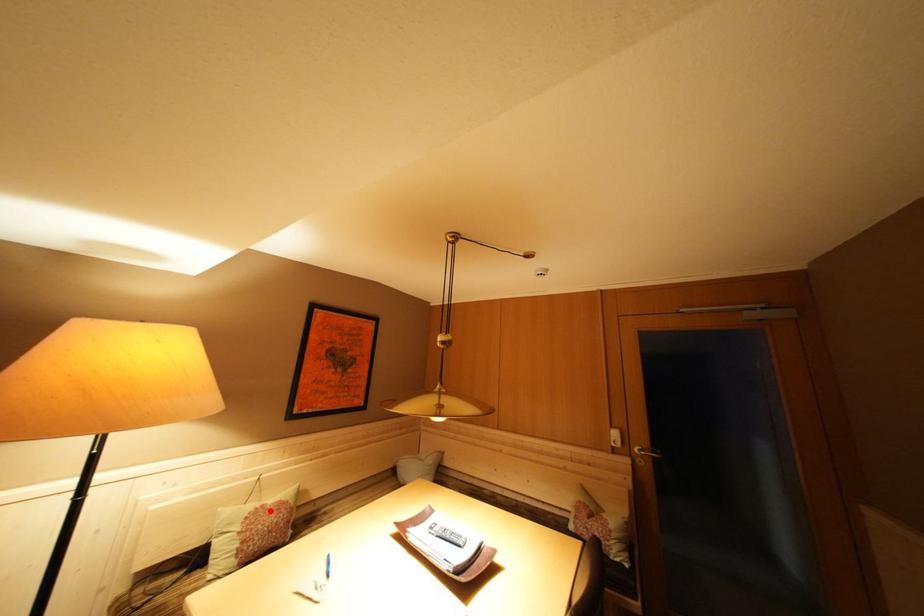
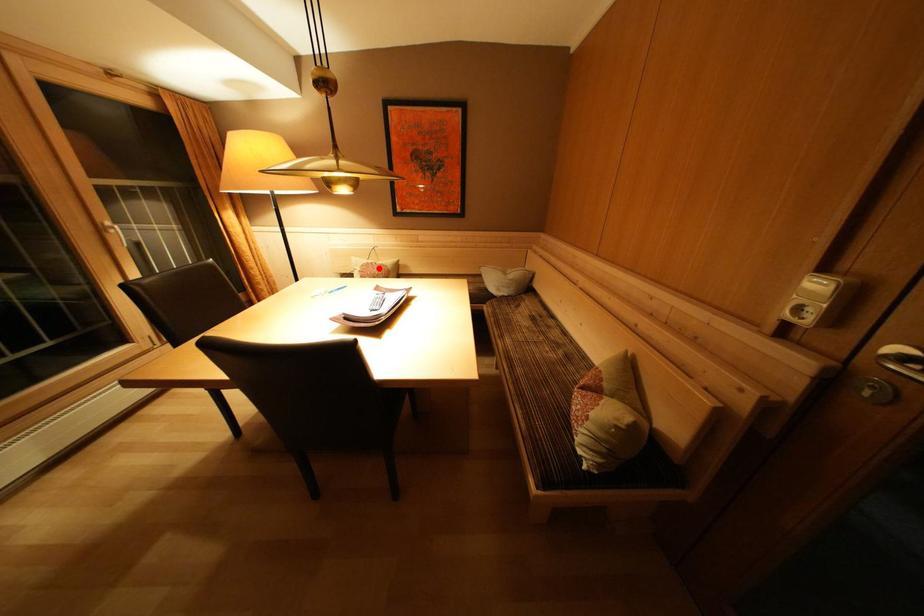
I am providing you with two images of the same scene from different viewpoints. A red point is marked on the first image and another point is marked on the second image. Do the highlighted points in image1 and image2 indicate the same real-world spot?

Yes